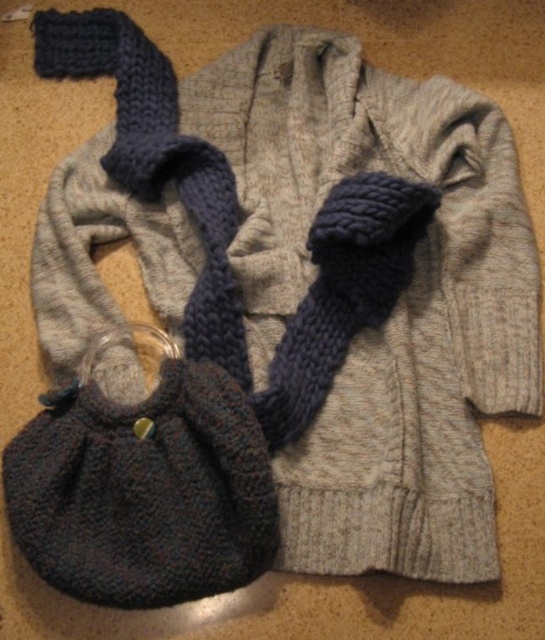
You are organizing a knitted items display and need to place the knitted dark gray purse at lower left and the dark blue knitted scarf at center into storage boxes. The purse box can only hold items smaller than the scarf. Will the purse fit in its designated box?

The knitted dark gray purse at lower left has a smaller size compared to the dark blue knitted scarf at center, so yes, the purse will fit in the box designed for smaller items.

You are organizing a display of knitted items and need to place a new item between the knitted dark gray purse at lower left and the light gray, ribbed cardigan at center. Where should you place the new item to ensure it is centered between them?

The knitted dark gray purse at lower left is located at point (143, 486). To center the new item between it and the light gray, ribbed cardigan at center, calculate the midpoint between their coordinates. However, since the cardigan is at the center, its coordinates would be approximately (272, 320). The midpoint would be at the average of the x and y coordinates of both points. The midpoint x is 0.762 and 0.5 divided by 2 equals 0.631, and the midpoint y is 0.264 and 0.5 divided by 2 equals 0.382. Thus, 0.

You are standing in front of the image and want to touch the point at coordinates point (87, 513) first before reaching the point (209, 234). Can you do this without moving your hand backward?

Yes, because point (87, 513) is in front of point (209, 234), so you can touch it first without moving your hand backward.